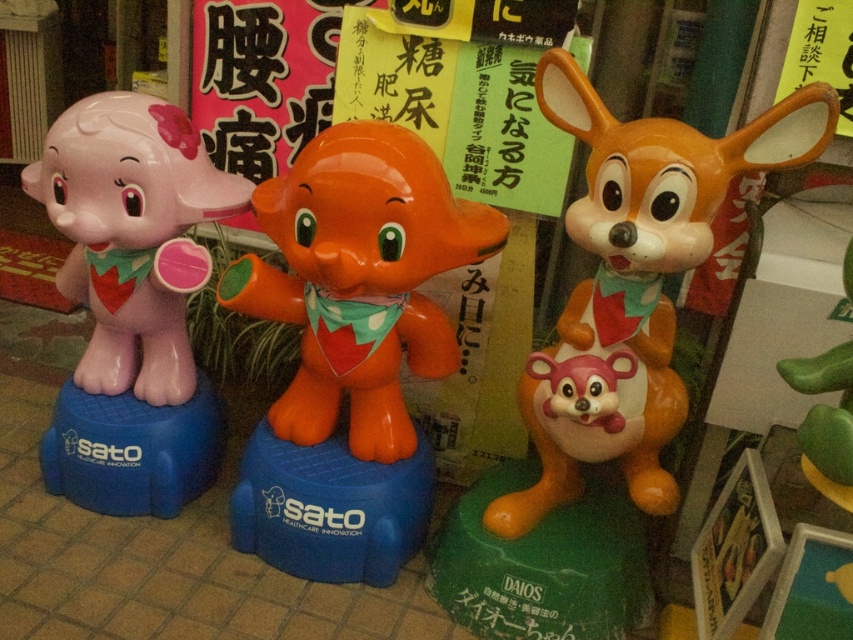
Question: In this image, where is matte orange plush toy at center located relative to matte plastic baby elephant at left?

Choices:
 (A) above
 (B) below

Answer: (B)

Question: Is matte orange plush toy at center to the right of glossy plastic elephant at center from the viewer's perspective?

Choices:
 (A) yes
 (B) no

Answer: (A)

Question: Which point is farther from the camera taking this photo?

Choices:
 (A) pyautogui.click(x=142, y=177)
 (B) pyautogui.click(x=531, y=371)
 (C) pyautogui.click(x=389, y=132)

Answer: (A)

Question: Which object is positioned closest to the glossy plastic elephant at center?

Choices:
 (A) matte orange plush toy at center
 (B) matte plastic baby elephant at left

Answer: (B)

Question: Is matte orange plush toy at center below matte plastic baby elephant at left?

Choices:
 (A) yes
 (B) no

Answer: (A)

Question: Which object appears closest to the camera in this image?

Choices:
 (A) matte orange plush toy at center
 (B) matte plastic baby elephant at left
 (C) glossy plastic elephant at center

Answer: (A)